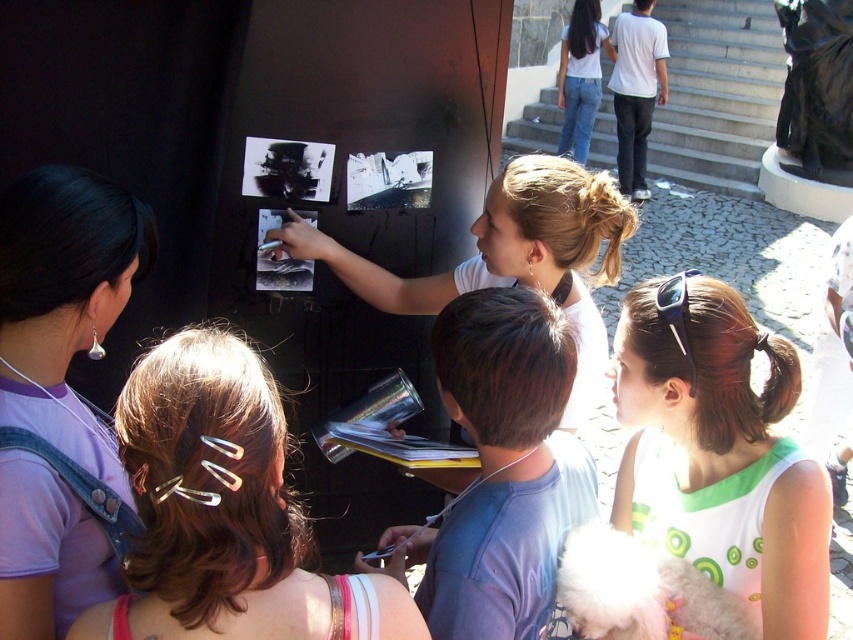
You are standing in front of the wall with the children. Where exactly is the matte purple shirt at upper left located in the image?

The matte purple shirt at upper left is located at point (64, 300) in the image.

You are a photographer trying to capture a group photo of the matte white shirt at center and the jeans at upper right. Based on their sizes, which one should you focus on to ensure they both fit in the frame without cropping?

The matte white shirt at center has a larger width than the jeans at upper right, so you should focus on the matte white shirt at center to ensure both fit in the frame without cropping.

You are a photographer trying to capture a candid shot of the children without them noticing. You want to position yourself at point [64,300]. What object will you be closest to?

At point [64,300] lies matte purple shirt at upper left, so you will be closest to the matte purple shirt at upper left.